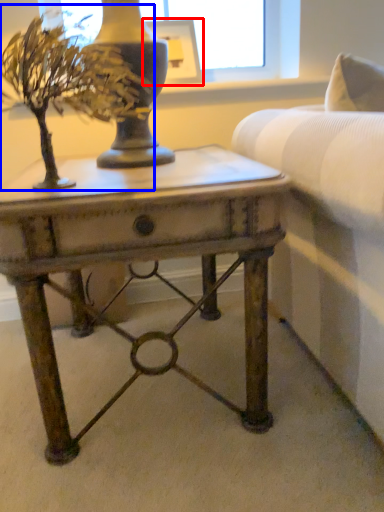
Question: Which object appears closest to the camera in this image, picture frame (highlighted by a red box) or houseplant (highlighted by a blue box)?

Choices:
 (A) picture frame
 (B) houseplant

Answer: (B)